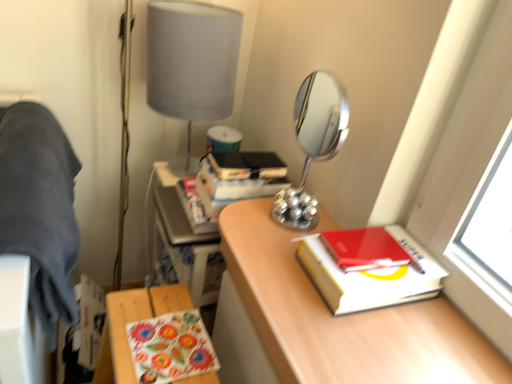
The image size is (512, 384). Find the location of `free space above hardcover book at right (from a real-world perspective)`. free space above hardcover book at right (from a real-world perspective) is located at coordinates (373, 249).